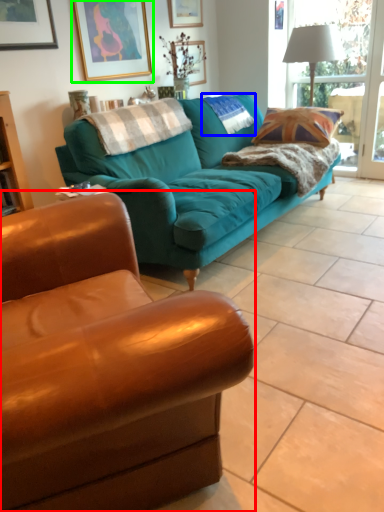
Question: Which object is positioned closest to studio couch (highlighted by a red box)? Select from pillow (highlighted by a blue box) and picture frame (highlighted by a green box).

Choices:
 (A) pillow
 (B) picture frame

Answer: (B)